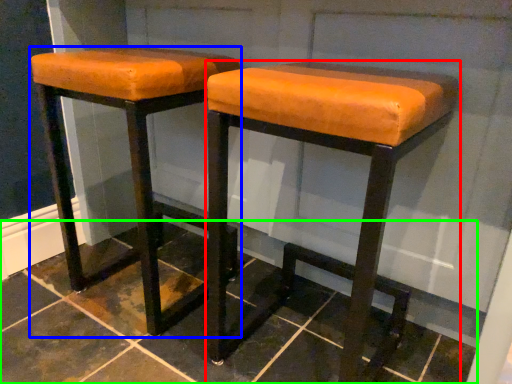
Question: Considering the real-world distances, which object is closest to stool (highlighted by a red box)? stool (highlighted by a blue box) or tile (highlighted by a green box).

Choices:
 (A) stool
 (B) tile

Answer: (A)